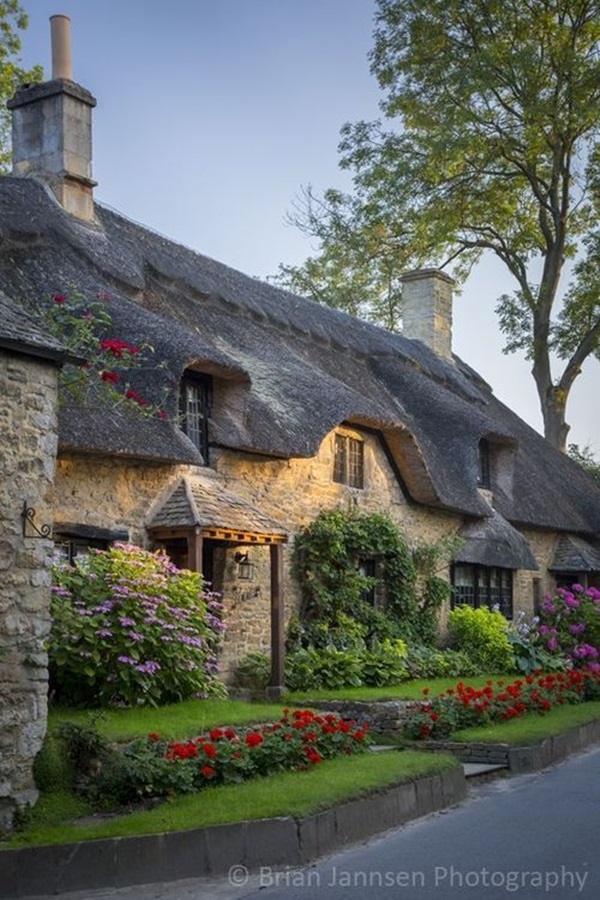
Where is `chimney`? Image resolution: width=600 pixels, height=900 pixels. chimney is located at coordinates (435, 312).